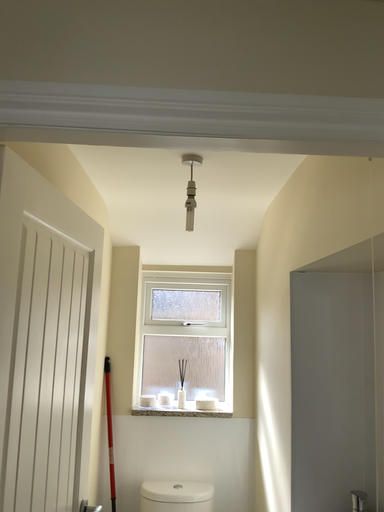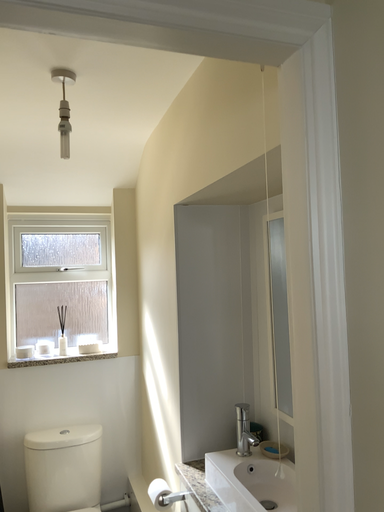
Question: Which way did the camera rotate in the video?

Choices:
 (A) rotated upward
 (B) rotated downward

Answer: (B)